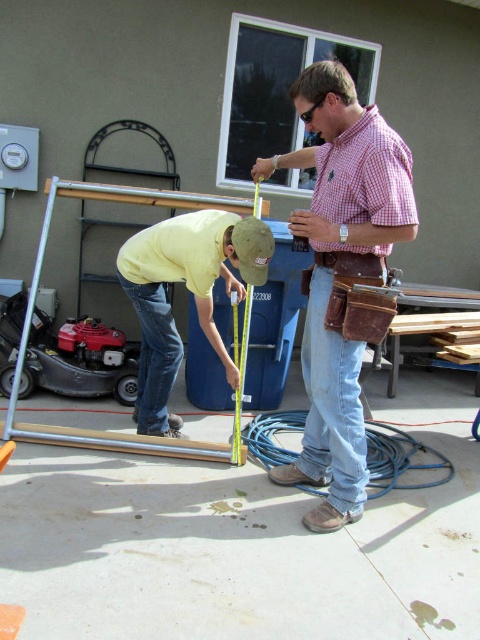
You are a construction worker standing at the point labeled as point (333, 273). You need to move to the checkered fabric shirt at center. Is the checkered fabric shirt at center located to your left or right side?

The point (333, 273) corresponds to the checkered fabric shirt at center, so the checkered fabric shirt at center is directly in front of you.

You are a contractor observing two workers assembling a metal frame. You notice the checkered fabric shirt at center and the yellow cotton shirt at lower left. Which worker is positioned closer to you?

The checkered fabric shirt at center is closer to the viewer than the yellow cotton shirt at lower left, so the worker wearing the checkered fabric shirt at center is positioned closer to you.

You are a contractor observing two workers assembling a metal frame. You notice the checkered fabric shirt at center and the yellow cotton shirt at lower left. Which worker is wearing a larger shirt?

The checkered fabric shirt at center is bigger than the yellow cotton shirt at lower left, so the worker wearing the checkered fabric shirt at center has the larger shirt.